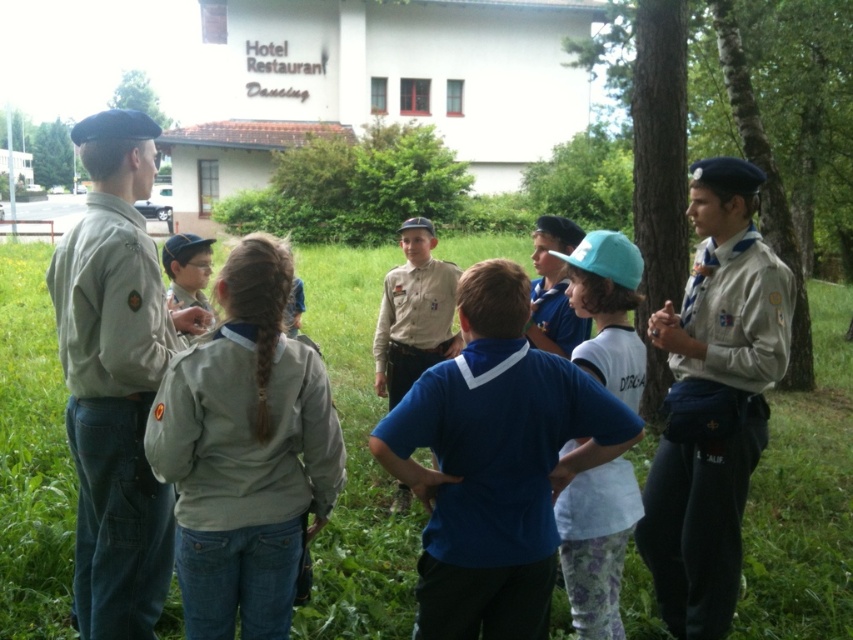
Who is higher up, light brown fabric uniform at right or white cotton shirt at center?

light brown fabric uniform at right is above.

Between light brown fabric uniform at right and white cotton shirt at center, which one appears on the right side from the viewer's perspective?

From the viewer's perspective, light brown fabric uniform at right appears more on the right side.

Where is `light brown fabric uniform at right`? light brown fabric uniform at right is located at coordinates (712, 428).

Which is more to the left, khaki fabric uniform at center or khaki fabric uniform at left?

khaki fabric uniform at left

Is khaki fabric uniform at center wider than khaki fabric uniform at left?

In fact, khaki fabric uniform at center might be narrower than khaki fabric uniform at left.

What do you see at coordinates (242, 476) in the screenshot?
I see `khaki fabric uniform at center` at bounding box center [242, 476].

Image resolution: width=853 pixels, height=640 pixels. Identify the location of khaki fabric uniform at center. (242, 476).

Is blue cotton shirt at center shorter than khaki fabric uniform at left?

Yes, blue cotton shirt at center is shorter than khaki fabric uniform at left.

Which is in front, point (503, 612) or point (155, 259)?

Point (503, 612)

The image size is (853, 640). What are the coordinates of `blue cotton shirt at center` in the screenshot? It's located at click(x=495, y=480).